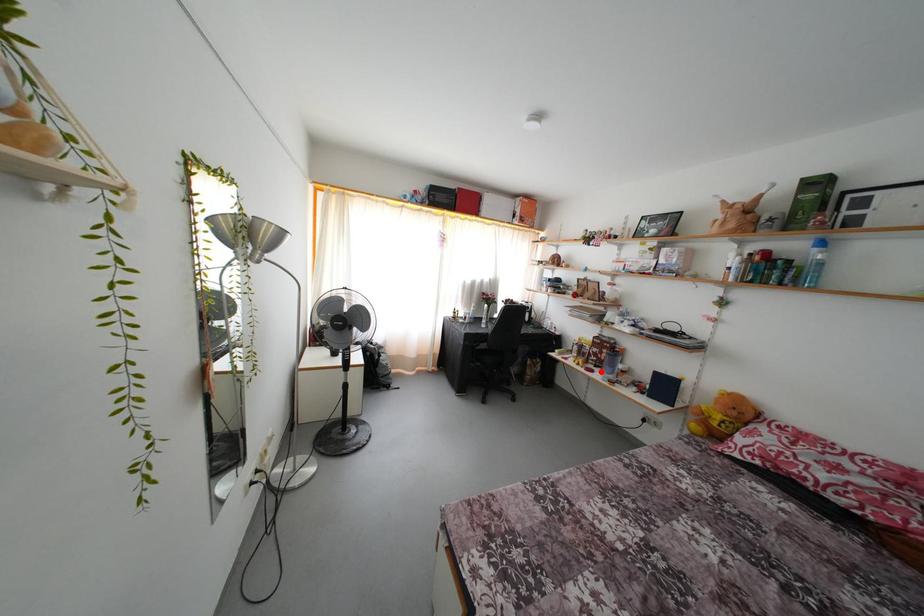
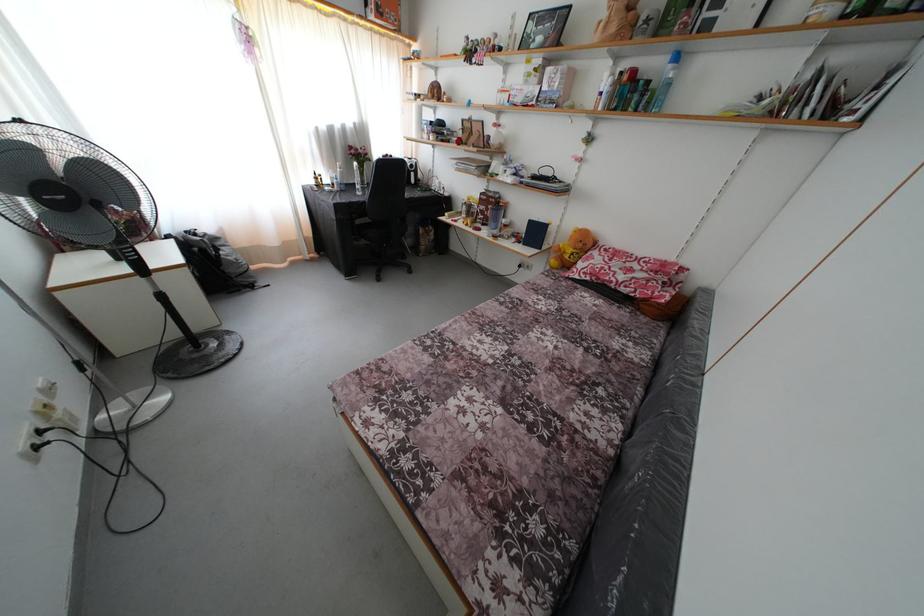
Locate, in the second image, the point that corresponds to the highlighted location in the first image.

(488, 230)